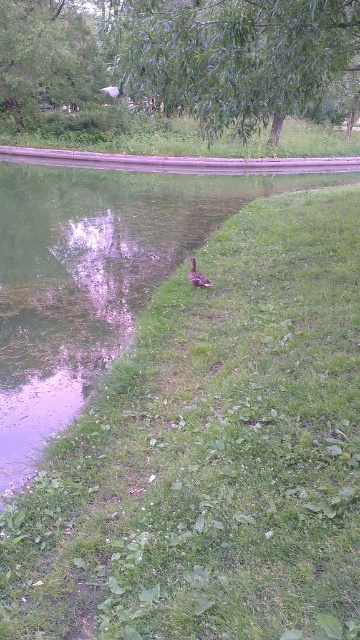
Question: Which point appears closest to the camera in this image?

Choices:
 (A) (171, 56)
 (B) (218, 435)
 (C) (6, 61)

Answer: (B)

Question: Does green leafy tree at upper center have a larger size compared to green leafy tree at upper left?

Choices:
 (A) no
 (B) yes

Answer: (B)

Question: Which object is farther from the camera taking this photo?

Choices:
 (A) green leafy tree at upper center
 (B) brown matte duck at center

Answer: (B)

Question: Considering the relative positions of green grass at center and brown matte duck at center in the image provided, where is green grass at center located with respect to brown matte duck at center?

Choices:
 (A) above
 (B) below

Answer: (B)

Question: Can you confirm if green leafy tree at upper left is bigger than brown matte duck at center?

Choices:
 (A) no
 (B) yes

Answer: (B)

Question: Which object appears closest to the camera in this image?

Choices:
 (A) green leafy tree at upper center
 (B) brown matte duck at center
 (C) green grass at center

Answer: (C)